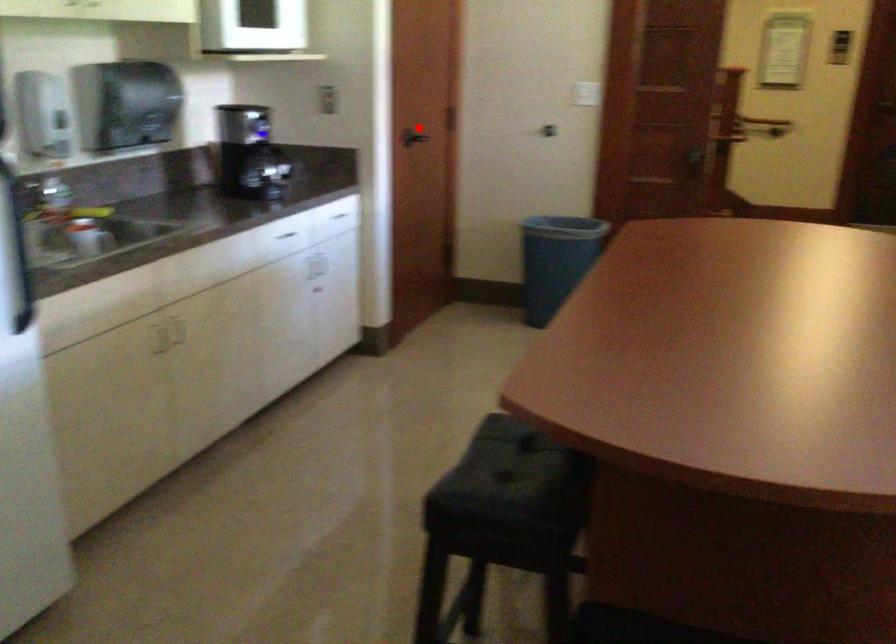
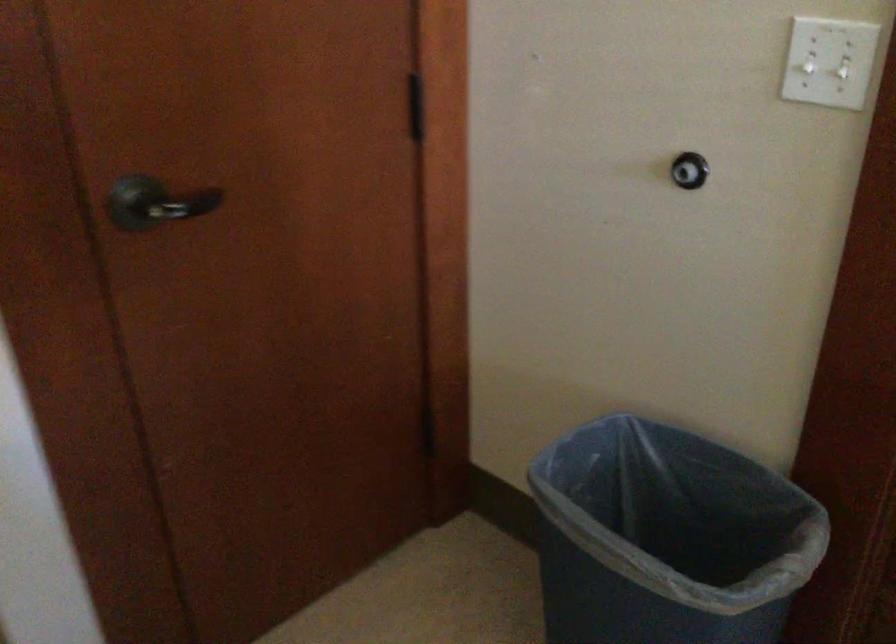
Where in the second image is the point corresponding to the highlighted location from the first image?

(156, 203)